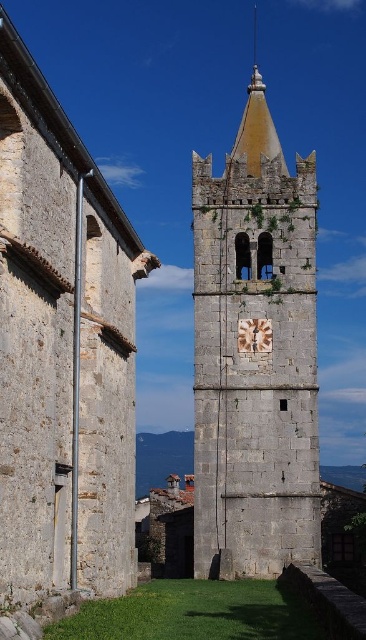
Between point (39, 173) and point (282, 476), which one is positioned behind?

The point (282, 476) is behind.

Is point (98, 396) less distant than point (229, 339)?

Yes, point (98, 396) is in front of point (229, 339).

I want to click on gray stone church tower at center, so click(x=61, y=353).

Based on the photo, does gray stone bell tower at center appear on the left side of rustic stone clock at center?

Incorrect, gray stone bell tower at center is not on the left side of rustic stone clock at center.

How much distance is there between gray stone bell tower at center and rustic stone clock at center?

8.24 meters

Measure the distance between point (211,428) and camera.

They are 72.64 meters apart.

Find the location of a particular element. This screenshot has width=366, height=640. gray stone bell tower at center is located at coordinates (255, 355).

Describe the element at coordinates (61, 353) in the screenshot. This screenshot has width=366, height=640. I see `gray stone church tower at center` at that location.

Is gray stone church tower at center taller than rustic stone clock at center?

Yes, gray stone church tower at center is taller than rustic stone clock at center.

Who is more distant from viewer, (42, 323) or (254, 323)?

The point (254, 323) is behind.

Locate an element on the screen. The image size is (366, 640). gray stone church tower at center is located at coordinates (61, 353).